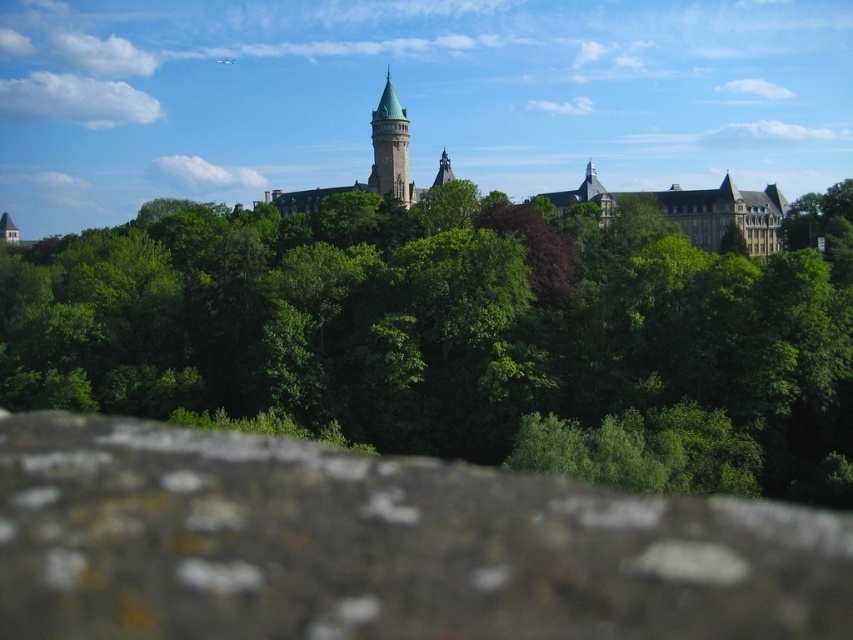
Question: Which of the following is the closest to the observer?

Choices:
 (A) (93, 472)
 (B) (238, 381)
 (C) (751, 204)

Answer: (A)

Question: Which of the following is the farthest from the observer?

Choices:
 (A) brown rough stone at lower center
 (B) green stone castle at center
 (C) green leafy tree at center
 (D) green stone tower at center

Answer: (B)

Question: Does green leafy tree at center appear on the left side of brown rough stone at lower center?

Choices:
 (A) no
 (B) yes

Answer: (A)

Question: Can you confirm if green leafy tree at center is thinner than green stone castle at center?

Choices:
 (A) yes
 (B) no

Answer: (B)

Question: Which of the following is the farthest from the observer?

Choices:
 (A) (769, 362)
 (B) (390, 116)
 (C) (601, 548)
 (D) (695, 218)

Answer: (D)

Question: Can you confirm if brown rough stone at lower center is positioned to the right of green stone tower at center?

Choices:
 (A) no
 (B) yes

Answer: (A)